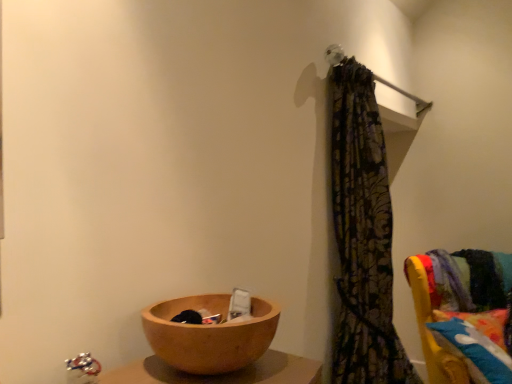
Question: From the image's perspective, would you say fluffy multicolored pillow at right is shown under patterned fabric curtain at upper right?

Choices:
 (A) no
 (B) yes

Answer: (B)

Question: From a real-world perspective, is fluffy multicolored pillow at right physically below patterned fabric curtain at upper right?

Choices:
 (A) yes
 (B) no

Answer: (A)

Question: Is fluffy multicolored pillow at right thinner than patterned fabric curtain at upper right?

Choices:
 (A) no
 (B) yes

Answer: (A)

Question: Is fluffy multicolored pillow at right bigger than patterned fabric curtain at upper right?

Choices:
 (A) no
 (B) yes

Answer: (A)

Question: Can you confirm if fluffy multicolored pillow at right is smaller than patterned fabric curtain at upper right?

Choices:
 (A) no
 (B) yes

Answer: (B)

Question: Is the position of fluffy multicolored pillow at right less distant than that of patterned fabric curtain at upper right?

Choices:
 (A) no
 (B) yes

Answer: (A)

Question: Can you confirm if patterned fabric curtain at upper right is taller than fluffy multicolored pillow at right?

Choices:
 (A) no
 (B) yes

Answer: (B)

Question: From the image's perspective, would you say patterned fabric curtain at upper right is positioned over fluffy multicolored pillow at right?

Choices:
 (A) yes
 (B) no

Answer: (A)

Question: Could fluffy multicolored pillow at right be considered to be inside patterned fabric curtain at upper right?

Choices:
 (A) yes
 (B) no

Answer: (B)

Question: Does patterned fabric curtain at upper right have a lesser width compared to fluffy multicolored pillow at right?

Choices:
 (A) no
 (B) yes

Answer: (B)

Question: Is patterned fabric curtain at upper right bigger than fluffy multicolored pillow at right?

Choices:
 (A) no
 (B) yes

Answer: (B)

Question: Could you tell me if patterned fabric curtain at upper right is facing fluffy multicolored pillow at right?

Choices:
 (A) no
 (B) yes

Answer: (A)

Question: From the image's perspective, does wooden bowl at lower left appear lower than patterned fabric curtain at upper right?

Choices:
 (A) no
 (B) yes

Answer: (B)